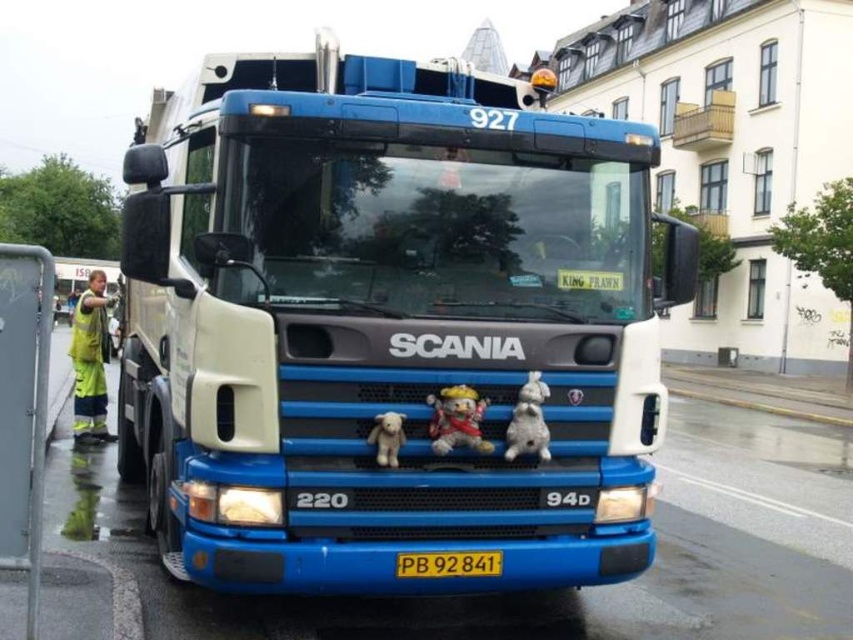
Locate an element on the screen. The image size is (853, 640). white plush toy at center is located at coordinates (527, 420).

Locate an element on the screen. The width and height of the screenshot is (853, 640). white plush toy at center is located at coordinates (527, 420).

Can you confirm if blue matte truck at center is positioned below white plush toy at center?

Indeed, blue matte truck at center is positioned under white plush toy at center.

At what (x,y) coordinates should I click in order to perform the action: click on blue matte truck at center. Please return your answer as a coordinate pair (x, y). This screenshot has height=640, width=853. Looking at the image, I should click on (389, 324).

Describe the element at coordinates (389, 324) in the screenshot. This screenshot has height=640, width=853. I see `blue matte truck at center` at that location.

You are a GUI agent. You are given a task and a screenshot of the screen. Output one action in this format:
    pyautogui.click(x=<x>, y=<y>)
    Task: Click on the blue matte truck at center
    The height and width of the screenshot is (640, 853).
    Given the screenshot: What is the action you would take?
    pyautogui.click(x=389, y=324)

Does blue matte truck at center have a greater width compared to yellow plastic license plate at center?

Indeed, blue matte truck at center has a greater width compared to yellow plastic license plate at center.

Is point (428, 84) positioned after point (409, 552)?

Yes, point (428, 84) is farther from viewer.

Describe the element at coordinates (389, 324) in the screenshot. This screenshot has width=853, height=640. I see `blue matte truck at center` at that location.

At what (x,y) coordinates should I click in order to perform the action: click on blue matte truck at center. Please return your answer as a coordinate pair (x, y). This screenshot has height=640, width=853. Looking at the image, I should click on (389, 324).